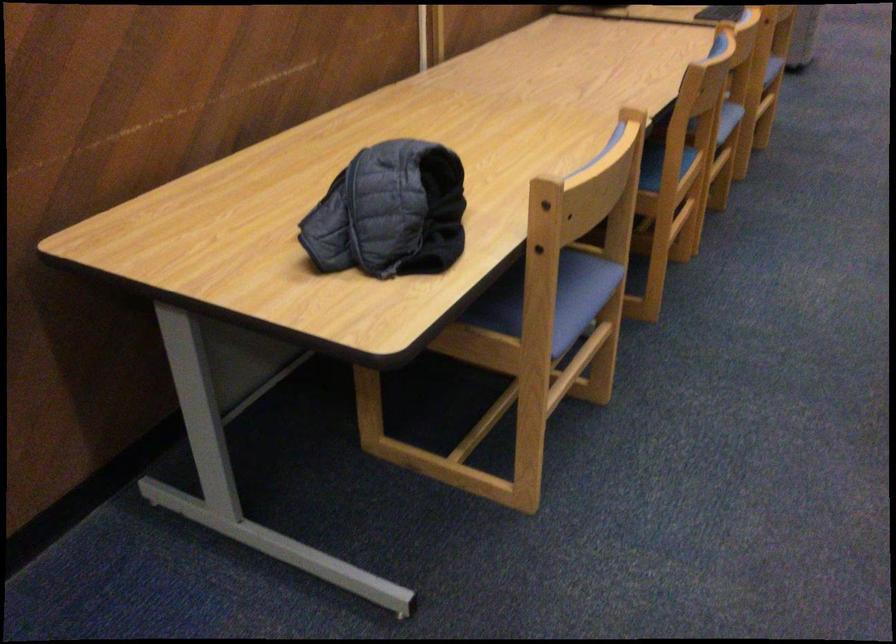
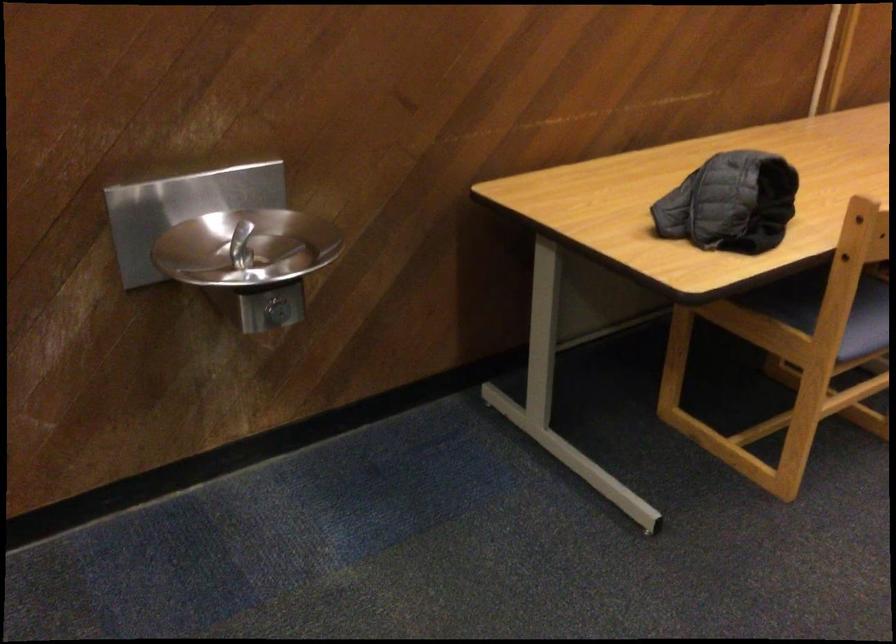
Which direction would the cameraman need to move to produce the second image?

The cameraman walked toward right, backward.